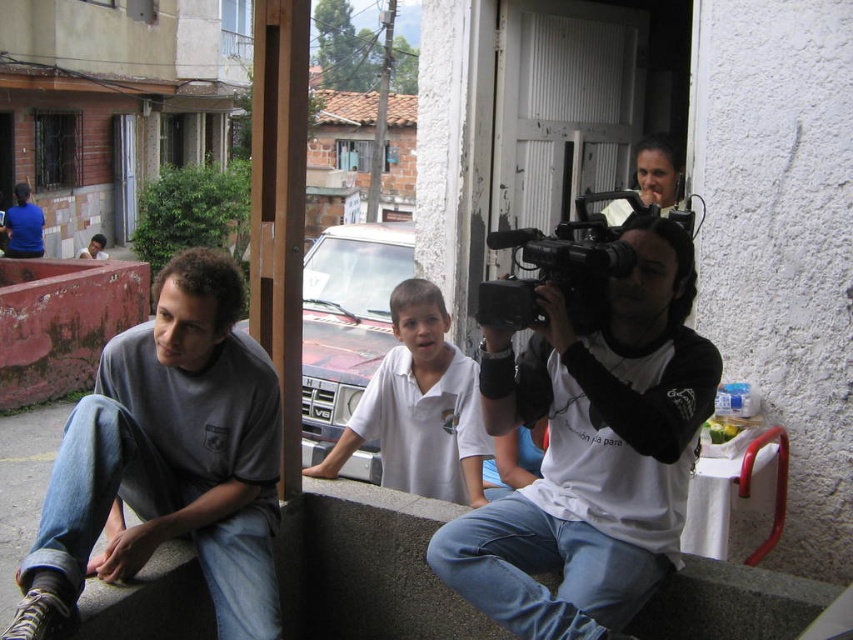
Question: Among these points, which one is farthest from the camera?

Choices:
 (A) (751, 627)
 (B) (480, 605)
 (C) (71, 499)
 (D) (601, 260)

Answer: (A)

Question: Can you confirm if gray cotton shirt at left is positioned to the left of black plastic video camera at center?

Choices:
 (A) no
 (B) yes

Answer: (B)

Question: Is gray cotton shirt at left to the left of white cotton shirt at center from the viewer's perspective?

Choices:
 (A) no
 (B) yes

Answer: (B)

Question: Is white matte camera at center smaller than black plastic video camera at center?

Choices:
 (A) no
 (B) yes

Answer: (A)

Question: Which is farther from the smooth concrete ledge at lower center?

Choices:
 (A) black plastic video camera at center
 (B) gray cotton shirt at left

Answer: (A)

Question: Which point appears closest to the camera in this image?

Choices:
 (A) (685, 332)
 (B) (331, 481)
 (C) (592, 252)

Answer: (C)